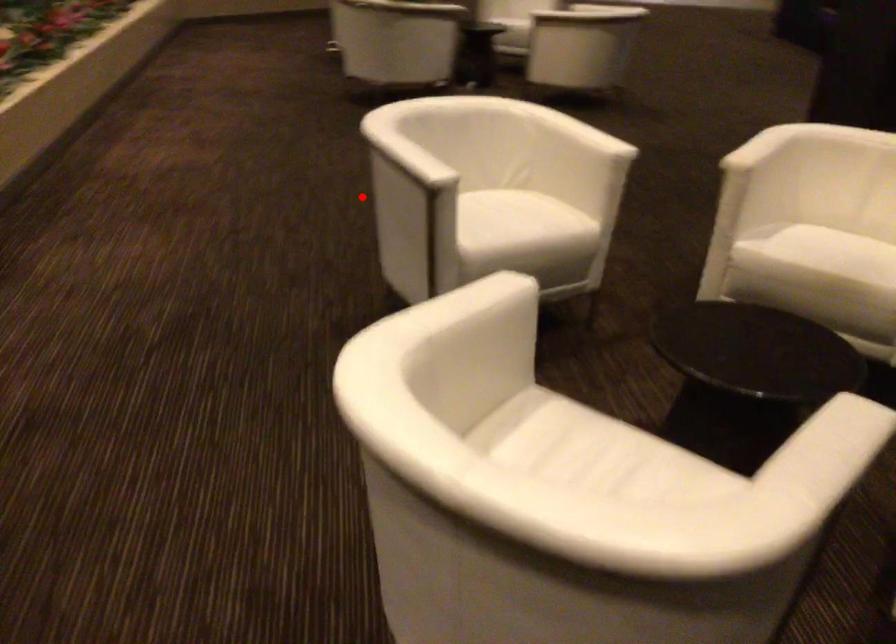
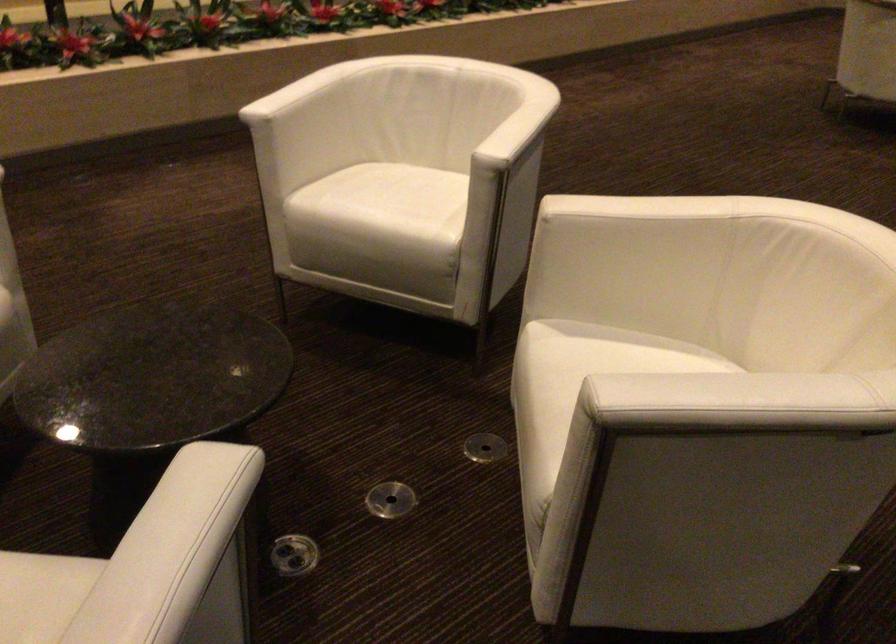
Question: I am providing you with two images of the same scene from different viewpoints. A red point is shown in image1. For the corresponding object point in image2, is it positioned nearer or farther from the camera?

Choices:
 (A) Nearer
 (B) Farther

Answer: (A)